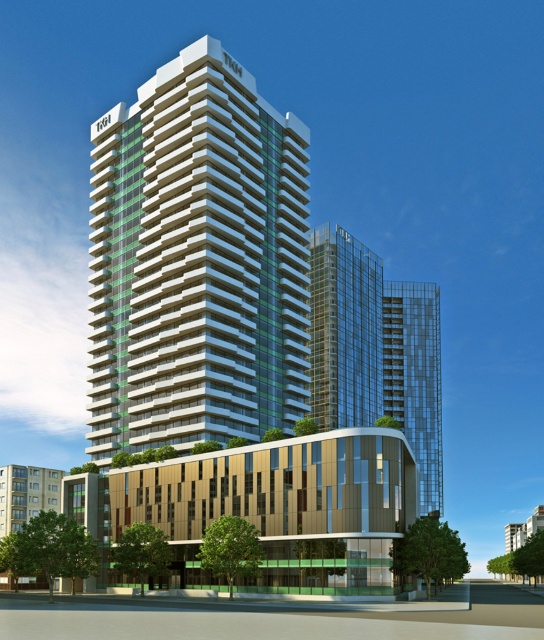
What do you see at coordinates (197, 260) in the screenshot? This screenshot has height=640, width=544. I see `white glossy building at center` at bounding box center [197, 260].

Is white glossy building at center positioned before transparent glass building at center?

That is True.

What do you see at coordinates (197, 260) in the screenshot? I see `white glossy building at center` at bounding box center [197, 260].

This screenshot has width=544, height=640. What are the coordinates of `white glossy building at center` in the screenshot? It's located at (197, 260).

Which is more to the left, white glossy building at center or clear glass skyscraper at center?

white glossy building at center is more to the left.

Consider the image. Who is more distant from viewer, (298, 138) or (311, 243)?

Point (311, 243)

Between point (95, 336) and point (312, 410), which one is positioned behind?

The point (312, 410) is behind.

You are a GUI agent. You are given a task and a screenshot of the screen. Output one action in this format:
    pyautogui.click(x=<x>, y=<y>)
    Task: Click on the white glossy building at center
    The height and width of the screenshot is (640, 544).
    Given the screenshot: What is the action you would take?
    pyautogui.click(x=197, y=260)

In the scene shown: Can you confirm if clear glass skyscraper at center is thinner than transparent glass building at center?

Incorrect, clear glass skyscraper at center's width is not less than transparent glass building at center's.

The width and height of the screenshot is (544, 640). What do you see at coordinates (344, 330) in the screenshot? I see `clear glass skyscraper at center` at bounding box center [344, 330].

Image resolution: width=544 pixels, height=640 pixels. I want to click on clear glass skyscraper at center, so click(344, 330).